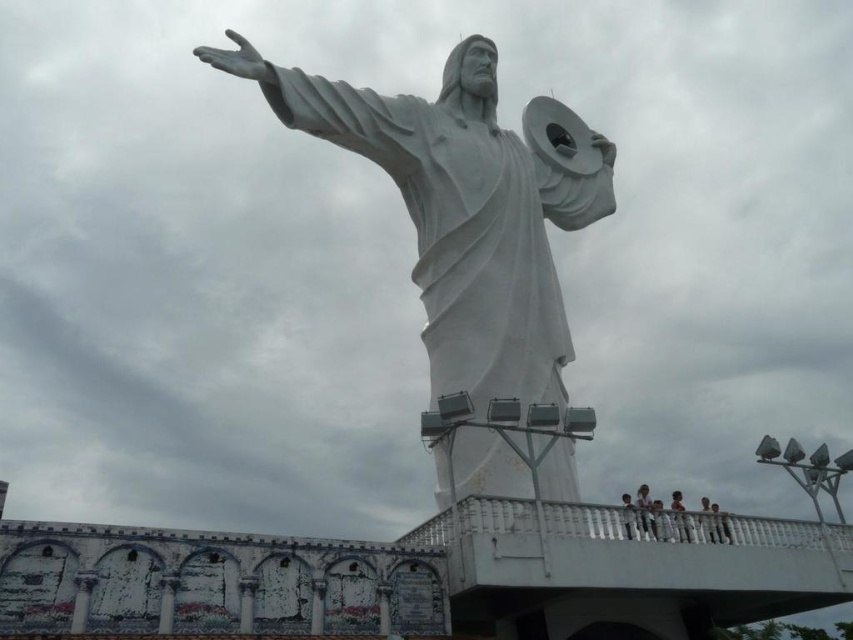
Which of these two, light brown wooden fence at lower right or white marble person at lower right, stands shorter?

Standing shorter between the two is light brown wooden fence at lower right.

Between light brown wooden fence at lower right and white marble person at lower right, which one is positioned lower?

Positioned lower is white marble person at lower right.

Does point (645, 502) come behind point (718, 540)?

Yes, point (645, 502) is behind point (718, 540).

Where is `light brown wooden fence at lower right`? light brown wooden fence at lower right is located at coordinates (645, 509).

This screenshot has height=640, width=853. I want to click on white painted metal railing at lower center, so click(x=474, y=520).

Locate an element on the screen. white painted metal railing at lower center is located at coordinates (474, 520).

Which is more to the left, white painted metal railing at lower center or light skin human at center?

From the viewer's perspective, white painted metal railing at lower center appears more on the left side.

Is white painted metal railing at lower center below light skin human at center?

Yes, white painted metal railing at lower center is below light skin human at center.

Is point (511, 515) positioned after point (624, 518)?

No, it is not.

Locate an element on the screen. This screenshot has width=853, height=640. white painted metal railing at lower center is located at coordinates (474, 520).